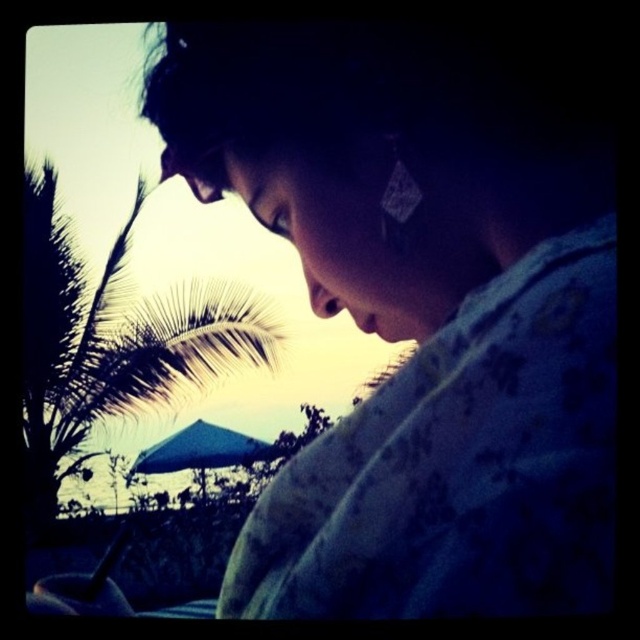
Question: Which object is farther from the camera taking this photo?

Choices:
 (A) silvery leafy palm tree at upper left
 (B) matte floral shirt at center

Answer: (A)

Question: Which of the following is the farthest from the observer?

Choices:
 (A) matte floral shirt at center
 (B) silvery leafy palm tree at upper left

Answer: (B)

Question: Is matte floral shirt at center closer to camera compared to silvery leafy palm tree at upper left?

Choices:
 (A) yes
 (B) no

Answer: (A)

Question: Which point appears farthest from the camera in this image?

Choices:
 (A) (84, 397)
 (B) (330, 109)

Answer: (A)

Question: Can you confirm if matte floral shirt at center is positioned to the right of silvery leafy palm tree at upper left?

Choices:
 (A) no
 (B) yes

Answer: (B)

Question: Is matte floral shirt at center smaller than silvery leafy palm tree at upper left?

Choices:
 (A) no
 (B) yes

Answer: (B)